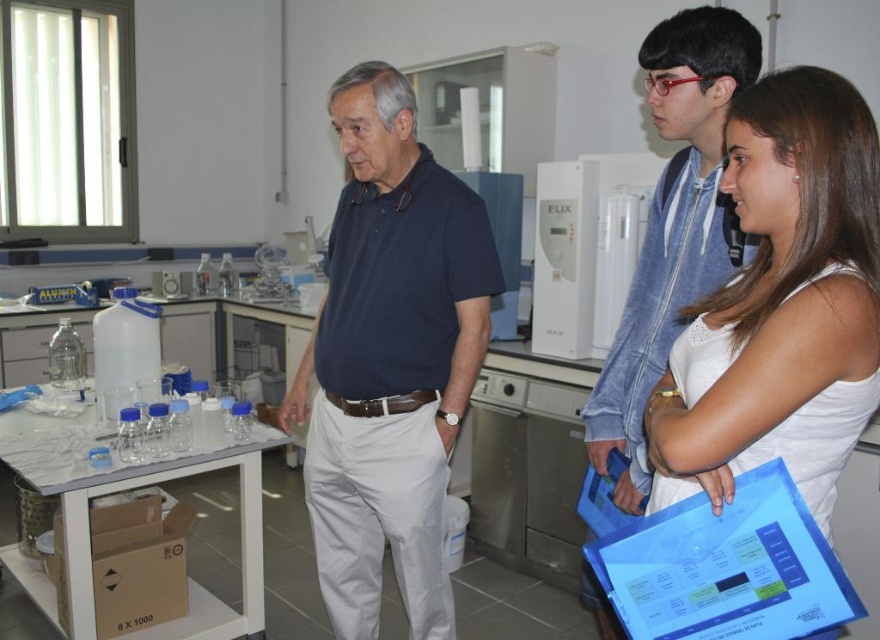
Is dark blue cotton polo shirt at center closer to camera compared to white matte tank top at upper right?

No, it is behind white matte tank top at upper right.

Who is more distant from viewer, (x=353, y=496) or (x=649, y=451)?

The point (x=353, y=496) is more distant.

Where is `dark blue cotton polo shirt at center`? This screenshot has width=880, height=640. dark blue cotton polo shirt at center is located at coordinates (390, 358).

Who is shorter, white matte tank top at upper right or blue denim jacket at upper right?

white matte tank top at upper right

Who is taller, white matte tank top at upper right or blue denim jacket at upper right?

With more height is blue denim jacket at upper right.

Describe the element at coordinates (781, 304) in the screenshot. I see `white matte tank top at upper right` at that location.

Where is `white matte tank top at upper right`? The image size is (880, 640). white matte tank top at upper right is located at coordinates (781, 304).

How much distance is there between dark blue cotton polo shirt at center and blue denim jacket at upper right?

dark blue cotton polo shirt at center is 21.07 inches from blue denim jacket at upper right.

Is point (358, 320) behind point (684, 72)?

Yes, it is behind point (684, 72).

You are a GUI agent. You are given a task and a screenshot of the screen. Output one action in this format:
    pyautogui.click(x=<x>, y=<y>)
    Task: Click on the dark blue cotton polo shirt at center
    
    Given the screenshot: What is the action you would take?
    pyautogui.click(x=390, y=358)